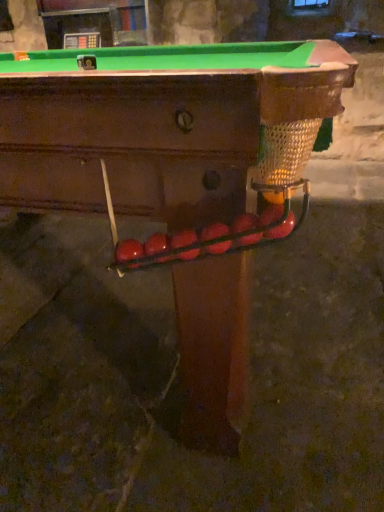
Question: Can you confirm if rubberized red ball at center, placed as the fourth fruit when sorted from right to left, is positioned to the right of glossy red balls at center, the fifth fruit in the right-to-left sequence?

Choices:
 (A) no
 (B) yes

Answer: (B)

Question: Can you confirm if rubberized red ball at center, placed as the fourth fruit when sorted from right to left, is wider than glossy red balls at center, placed as the 2th fruit when sorted from left to right?

Choices:
 (A) no
 (B) yes

Answer: (A)

Question: From the image's perspective, would you say rubberized red ball at center, which appears as the 3th fruit when viewed from the left, is positioned over glossy red balls at center, the fifth fruit in the right-to-left sequence?

Choices:
 (A) no
 (B) yes

Answer: (B)

Question: Can you confirm if rubberized red ball at center, placed as the fourth fruit when sorted from right to left, is positioned to the left of glossy red balls at center, placed as the 2th fruit when sorted from left to right?

Choices:
 (A) no
 (B) yes

Answer: (A)

Question: Is the position of rubberized red ball at center, placed as the fourth fruit when sorted from right to left, more distant than that of glossy red balls at center, the fifth fruit in the right-to-left sequence?

Choices:
 (A) yes
 (B) no

Answer: (B)

Question: Looking at their shapes, would you say glossy red ball at center, placed as the 3th fruit when sorted from right to left, is wider or thinner than glossy red apple at right, placed as the sixth fruit when sorted from left to right?

Choices:
 (A) thin
 (B) wide

Answer: (A)

Question: Is glossy red ball at center, placed as the 3th fruit when sorted from right to left, in front of or behind glossy red apple at right, placed as the sixth fruit when sorted from left to right, in the image?

Choices:
 (A) behind
 (B) front

Answer: (A)

Question: Is glossy red ball at center, placed as the 3th fruit when sorted from right to left, to the left or to the right of glossy red apple at right, which ranks as the first fruit in right-to-left order, in the image?

Choices:
 (A) left
 (B) right

Answer: (A)

Question: Is glossy red ball at center, the 4th fruit viewed from the left, inside or outside of glossy red apple at right, placed as the sixth fruit when sorted from left to right?

Choices:
 (A) inside
 (B) outside

Answer: (B)

Question: From the image's perspective, is glossy red apple at lower center, the first fruit when ordered from left to right, located above or below rubberized red ball at center, placed as the fourth fruit when sorted from right to left?

Choices:
 (A) below
 (B) above

Answer: (A)

Question: Is glossy red apple at lower center, the 6th fruit viewed from the right, in front of or behind rubberized red ball at center, placed as the fourth fruit when sorted from right to left, in the image?

Choices:
 (A) front
 (B) behind

Answer: (B)

Question: Visually, is glossy red apple at lower center, the 6th fruit viewed from the right, positioned to the left or to the right of rubberized red ball at center, which appears as the 3th fruit when viewed from the left?

Choices:
 (A) left
 (B) right

Answer: (A)

Question: In terms of size, does glossy red apple at lower center, the 6th fruit viewed from the right, appear bigger or smaller than rubberized red ball at center, which appears as the 3th fruit when viewed from the left?

Choices:
 (A) big
 (B) small

Answer: (A)

Question: Is glossy red apple at right, which ranks as the first fruit in right-to-left order, spatially inside glossy red ball at center, the 2th fruit from the right, or outside of it?

Choices:
 (A) outside
 (B) inside

Answer: (A)

Question: From their relative heights in the image, would you say glossy red apple at right, placed as the sixth fruit when sorted from left to right, is taller or shorter than glossy red ball at center, the 2th fruit from the right?

Choices:
 (A) tall
 (B) short

Answer: (A)